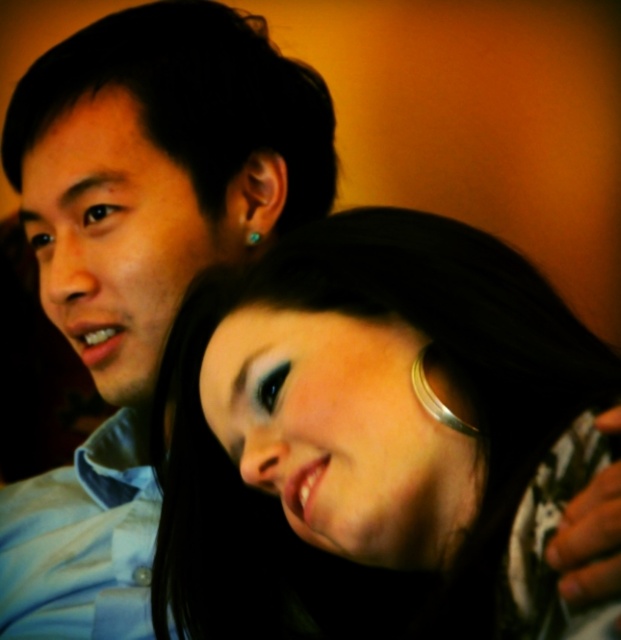
Who is higher up, smooth silver necklace at center or matte blue shirt at left?

matte blue shirt at left is higher up.

Between smooth silver necklace at center and matte blue shirt at left, which one has less height?

With less height is smooth silver necklace at center.

Does point (415, 275) come in front of point (238, 42)?

Yes, it is.

You are a GUI agent. You are given a task and a screenshot of the screen. Output one action in this format:
    pyautogui.click(x=<x>, y=<y>)
    Task: Click on the smooth silver necklace at center
    Image resolution: width=621 pixels, height=640 pixels.
    Given the screenshot: What is the action you would take?
    pyautogui.click(x=373, y=436)